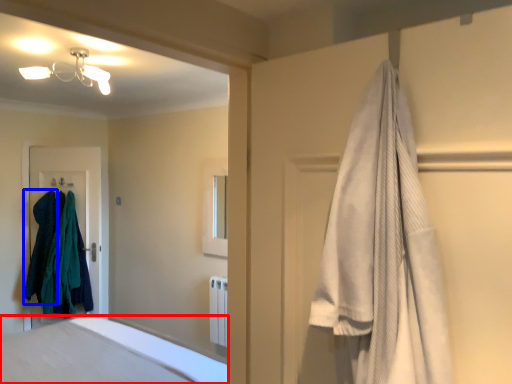
Question: Which object appears closest to the camera in this image, bathtub (highlighted by a red box) or clothing (highlighted by a blue box)?

Choices:
 (A) bathtub
 (B) clothing

Answer: (A)